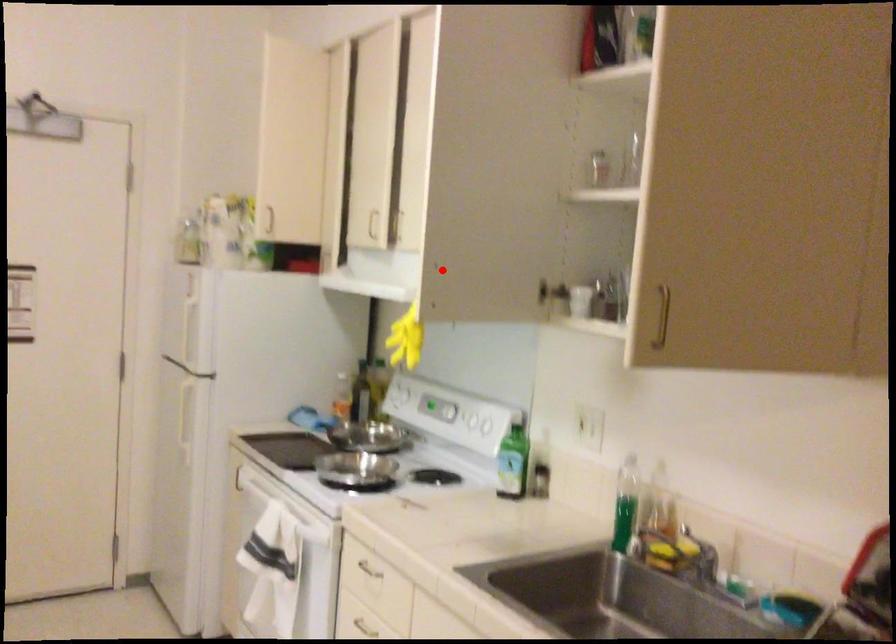
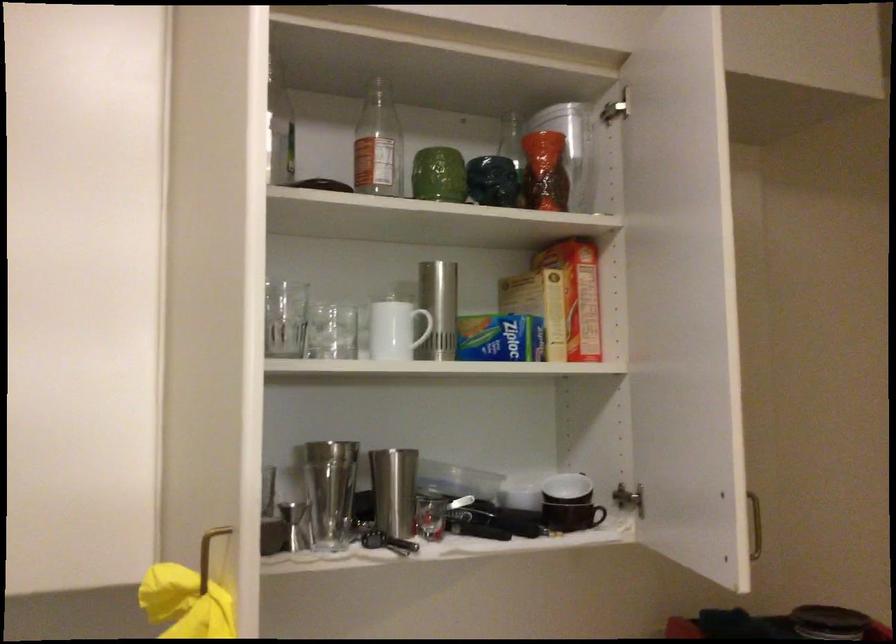
Where in the second image is the point corresponding to the highlighted location from the first image?

(209, 554)